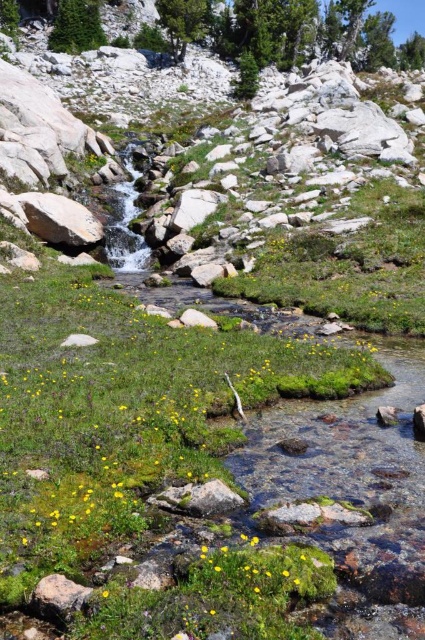
Who is more distant from viewer, [282,566] or [282,572]?

The point [282,566] is more distant.

Can you confirm if yellow matte flower at lower center is smaller than yellow matte flower at center?

Actually, yellow matte flower at lower center might be larger than yellow matte flower at center.

Locate an element on the screen. This screenshot has height=640, width=425. yellow matte flower at lower center is located at coordinates (252, 570).